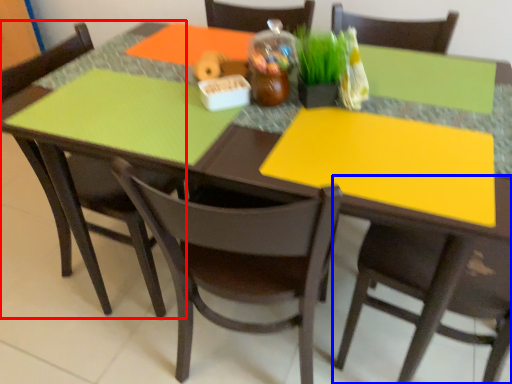
Question: Which of the following is the closest to the observer, chair (highlighted by a red box) or chair (highlighted by a blue box)?

Choices:
 (A) chair
 (B) chair

Answer: (B)